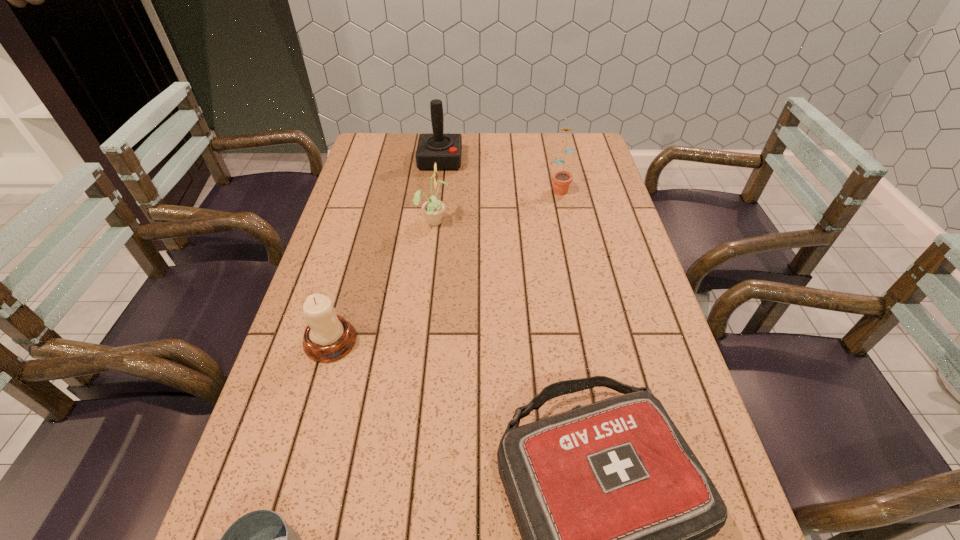
Identify the location of free space between the fifth nearest object and the nearer sunflower. (496, 204).

Image resolution: width=960 pixels, height=540 pixels. Find the location of `blank region between the farther sunflower and the nearer sunflower`. blank region between the farther sunflower and the nearer sunflower is located at coordinates (496, 204).

The width and height of the screenshot is (960, 540). Find the location of `object that stands as the fifth closest to the fourth farthest object`. object that stands as the fifth closest to the fourth farthest object is located at coordinates (561, 180).

Locate which object is the fourth closest to the first-aid kit. Please provide its 2D coordinates. Your answer should be formatted as a tuple, i.e. [(x, y)], where the tuple contains the x and y coordinates of a point satisfying the conditions above.

[(561, 180)]